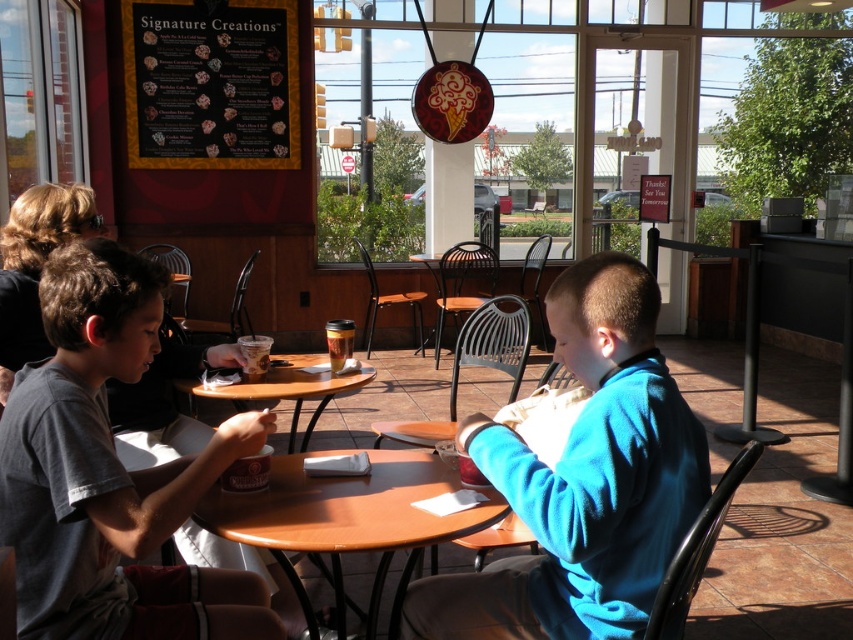
The image size is (853, 640). Describe the element at coordinates (111, 472) in the screenshot. I see `gray cotton shirt at left` at that location.

Is gray cotton shirt at left closer to the viewer compared to blue fleece jacket at center?

No, it is not.

Does point (77, 627) come farther from viewer compared to point (593, 493)?

Yes, point (77, 627) is farther from viewer.

Where is `gray cotton shirt at left`? gray cotton shirt at left is located at coordinates (111, 472).

Between point (685, 492) and point (346, 320), which one is positioned behind?

Point (346, 320)

Is point (650, 296) closer to camera compared to point (335, 360)?

Yes, it is in front of point (335, 360).

Is point (537, 513) closer to camera compared to point (345, 349)?

That is True.

At what (x,y) coordinates should I click in order to perform the action: click on blue fleece jacket at center. Please return your answer as a coordinate pair (x, y). Looking at the image, I should click on (583, 481).

Can you confirm if gray cotton shirt at left is taller than brown wooden table at center?

Answer: Indeed, gray cotton shirt at left has a greater height compared to brown wooden table at center.

Can you confirm if gray cotton shirt at left is positioned to the right of brown wooden table at center?

Correct, you'll find gray cotton shirt at left to the right of brown wooden table at center.

Does point (6, 444) lie behind point (184, 388)?

No.

The height and width of the screenshot is (640, 853). Find the location of `gray cotton shirt at left`. gray cotton shirt at left is located at coordinates (111, 472).